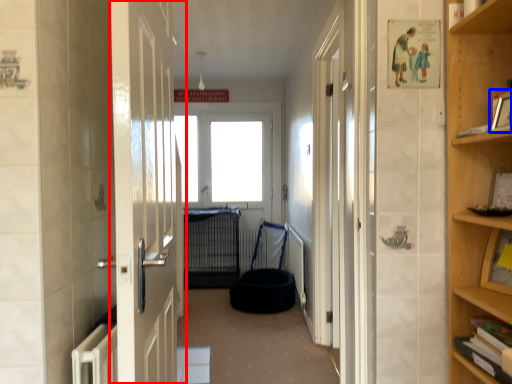
Question: Which of the following is the closest to the observer, door (highlighted by a red box) or picture frame (highlighted by a blue box)?

Choices:
 (A) door
 (B) picture frame

Answer: (A)